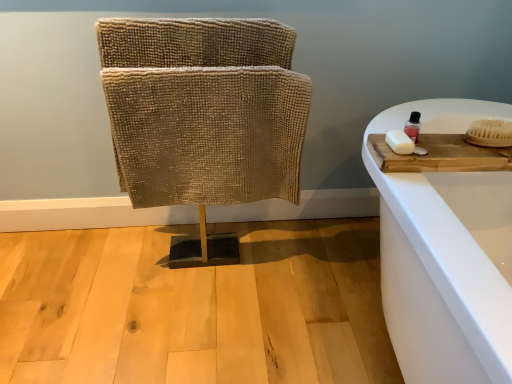
Question: From the image's perspective, is beige textured fabric at center above or below white matte soap at right?

Choices:
 (A) above
 (B) below

Answer: (A)

Question: Considering the positions of point (117, 162) and point (395, 142), is point (117, 162) closer or farther from the camera than point (395, 142)?

Choices:
 (A) farther
 (B) closer

Answer: (A)

Question: Which of these objects is positioned farthest from the transparent plastic bottle at upper right?

Choices:
 (A) wooden cutting board at right
 (B) beige textured fabric at center
 (C) white bristle brush at right
 (D) white matte soap at right

Answer: (B)

Question: Estimate the real-world distances between objects in this image. Which object is closer to the white matte soap at right?

Choices:
 (A) beige textured fabric at center
 (B) white bristle brush at right
 (C) wooden cutting board at right
 (D) transparent plastic bottle at upper right

Answer: (D)